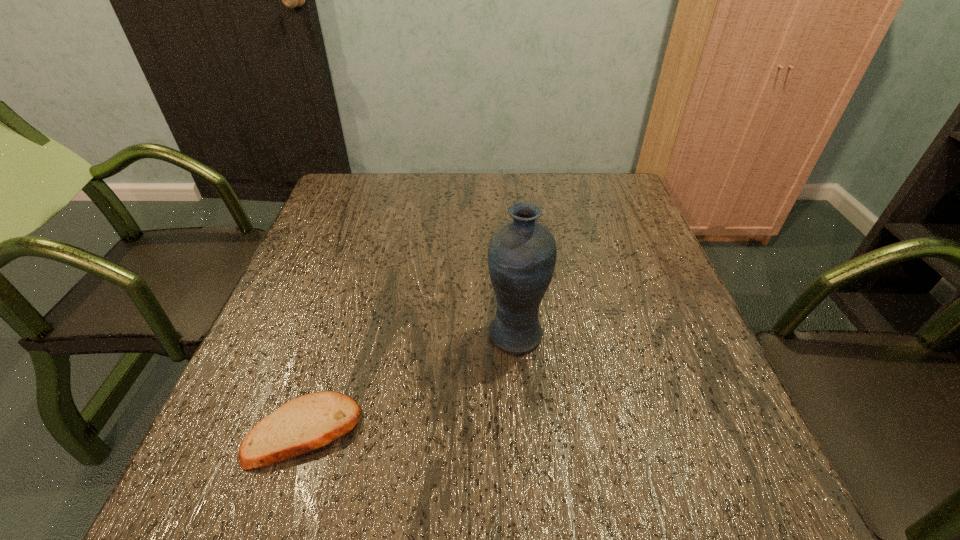
The image size is (960, 540). I want to click on vacant space at the near edge of the desktop, so click(x=367, y=492).

In order to click on free spot at the left edge of the desktop in this screenshot , I will do `click(322, 287)`.

This screenshot has height=540, width=960. In order to click on vacant space at the right edge in this screenshot , I will do `click(695, 386)`.

In the image, there is a desktop. Where is `vacant area at the far right corner`? This screenshot has height=540, width=960. vacant area at the far right corner is located at coordinates (612, 187).

The image size is (960, 540). In order to click on vacant space that satisfies the following two spatial constraints: 1. on the back side of the farther object; 2. on the left side of the left object in this screenshot , I will do `click(335, 334)`.